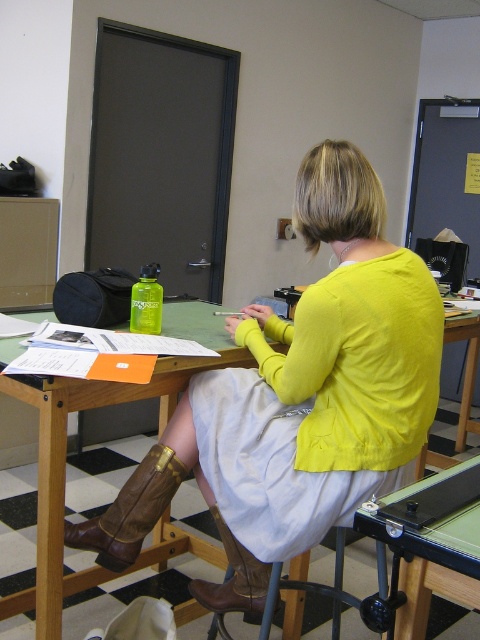
Identify the location of matte yellow sweater at center. The image size is (480, 640). (299, 397).

Is matte yellow sweater at center closer to the viewer compared to brown leather boot at lower center?

Yes, matte yellow sweater at center is closer to the viewer.

This screenshot has width=480, height=640. I want to click on matte yellow sweater at center, so click(299, 397).

Does point (204, 371) lie in front of point (183, 472)?

No, it is behind (183, 472).

This screenshot has width=480, height=640. Find the location of `matte yellow sweater at center`. matte yellow sweater at center is located at coordinates (299, 397).

Where is `matte yellow sweater at center`? matte yellow sweater at center is located at coordinates (299, 397).

Does brown leather boot at lower left lie in front of brown leather boot at lower center?

That is False.

Who is more forward, (175,461) or (265,580)?

Positioned in front is point (175,461).

Where is `brown leather boot at lower left`? brown leather boot at lower left is located at coordinates (130, 512).